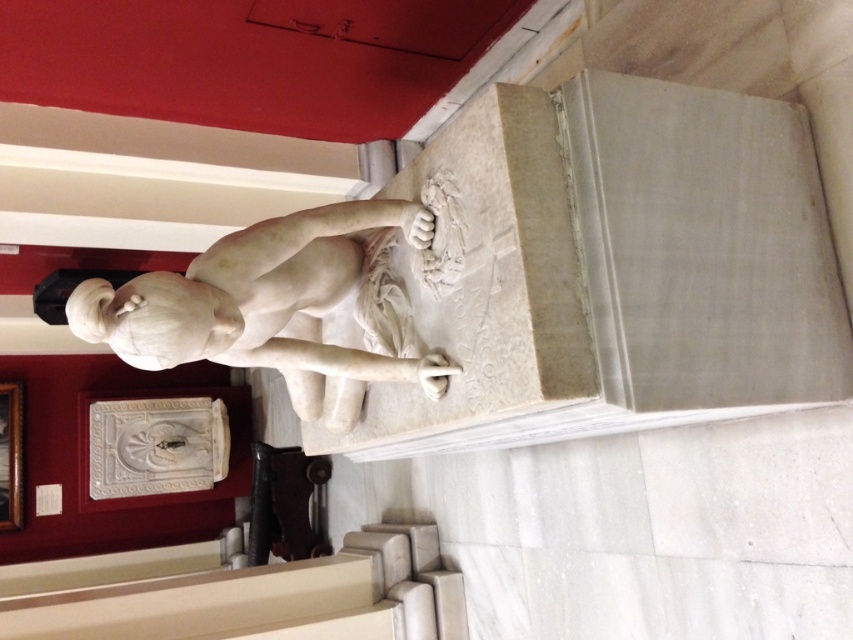
You are standing in the museum and want to approach the white marble statue at center. You see the white marble stairs at lower left. Which direction should you move to get closer to the statue?

You should move away from the white marble stairs at lower left because they are closer to you than the white marble statue at center, so moving away from them will bring you closer to the statue.

You are an art student standing at the entrance of the museum, and you want to sketch the white marble statue at center. To get a better view, you need to climb up the white marble stairs at lower left. Considering their widths, will the stairs provide enough space for you to comfortably stand and sketch?

The white marble stairs at lower left are wider than the white marble statue at center. Since the stairs are wider, they should provide sufficient space for you to stand and sketch comfortably.

You are a tour guide leading a group through the museum. You want to ensure that visitors can comfortably view the white marble statue at center from the white marble stairs at lower left. Given that the recommended viewing distance for such statues is at least 5 feet, is the current placement of the stairs adequate?

The distance between the white marble stairs at lower left and the white marble statue at center is 5.44 feet, which exceeds the recommended 5 feet viewing distance. Therefore, the current placement of the stairs is adequate for comfortable viewing.